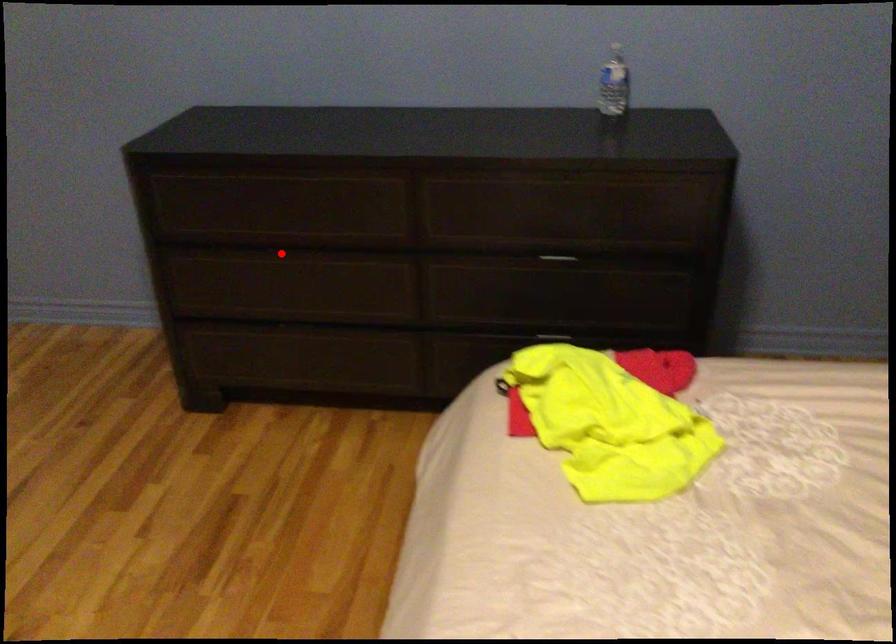
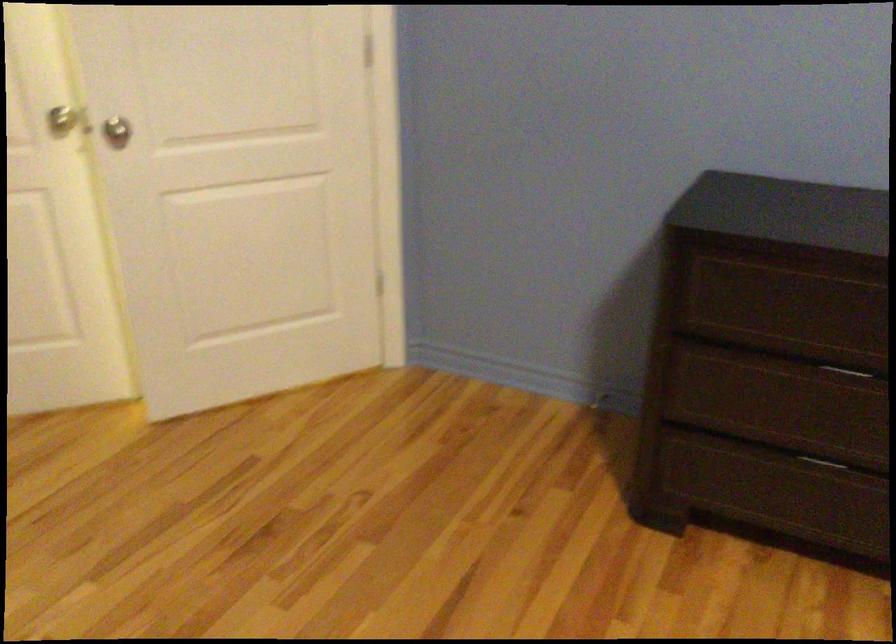
Question: I am providing you with two images of the same scene from different viewpoints. Given a red point in image1, look at the same physical point in image2. Is it:

Choices:
 (A) Closer to the viewpoint
 (B) Farther from the viewpoint

Answer: (A)